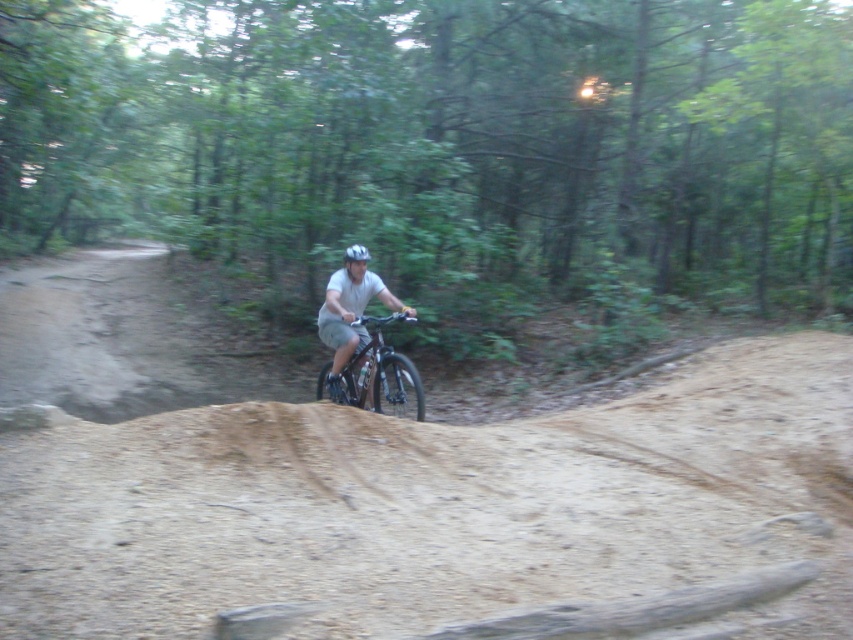
Question: Which object is the closest to the brown sandy dirt at center?

Choices:
 (A) shiny metallic bicycle at center
 (B) white matte bicycle helmet at center

Answer: (A)

Question: Which is nearer to the white matte bicycle helmet at center?

Choices:
 (A) shiny metallic bicycle at center
 (B) brown sandy dirt at center

Answer: (A)

Question: Can you confirm if shiny metallic bicycle at center is smaller than white matte bicycle helmet at center?

Choices:
 (A) no
 (B) yes

Answer: (A)

Question: Which object is the closest to the white matte bicycle helmet at center?

Choices:
 (A) shiny metallic bicycle at center
 (B) brown sandy dirt at center

Answer: (A)

Question: Does brown sandy dirt at center appear over white matte bicycle helmet at center?

Choices:
 (A) no
 (B) yes

Answer: (A)

Question: Does brown sandy dirt at center lie behind white matte bicycle helmet at center?

Choices:
 (A) yes
 (B) no

Answer: (B)